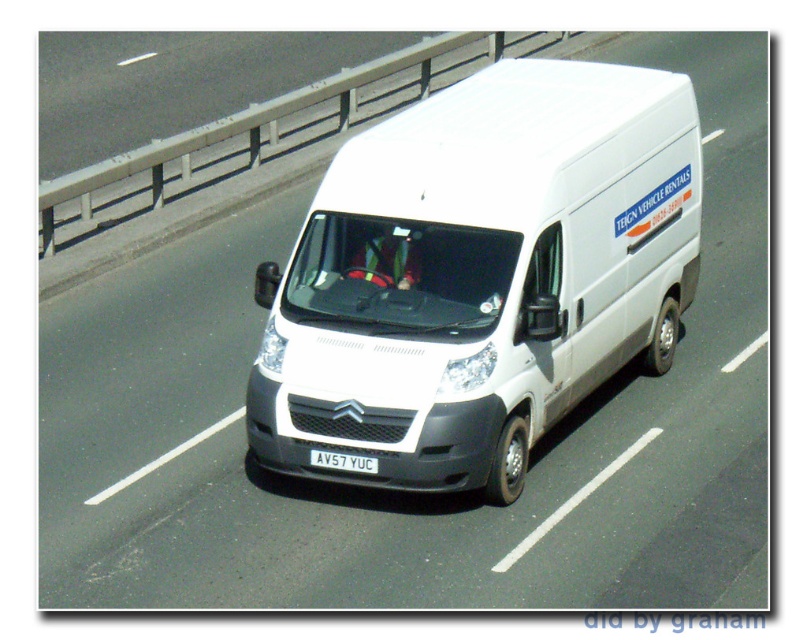
Question: Does white matte van at center lie in front of white plastic license plate at center?

Choices:
 (A) yes
 (B) no

Answer: (A)

Question: Which point is closer to the camera?

Choices:
 (A) (295, 250)
 (B) (318, 460)

Answer: (B)

Question: Which point appears closest to the camera in this image?

Choices:
 (A) (348, 464)
 (B) (362, 404)

Answer: (B)

Question: Does white matte van at center appear under white plastic license plate at center?

Choices:
 (A) yes
 (B) no

Answer: (B)

Question: Does white matte van at center appear on the left side of white plastic license plate at center?

Choices:
 (A) yes
 (B) no

Answer: (B)